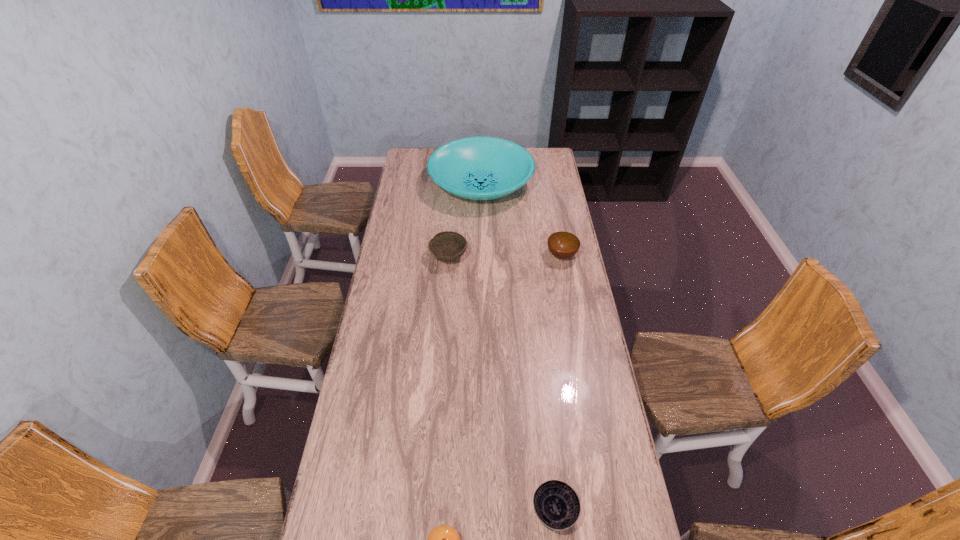
The height and width of the screenshot is (540, 960). I want to click on the tallest object, so click(478, 168).

Find the location of a particular element. the farthest object is located at coordinates (478, 168).

Where is `the leftmost bowl`? the leftmost bowl is located at coordinates (447, 246).

The image size is (960, 540). I want to click on the rightmost object, so click(x=563, y=245).

You are a GUI agent. You are given a task and a screenshot of the screen. Output one action in this format:
    pyautogui.click(x=<x>, y=<y>)
    Task: Click on the shortest object
    Image resolution: width=960 pixels, height=540 pixels.
    Given the screenshot: What is the action you would take?
    pyautogui.click(x=556, y=504)

The image size is (960, 540). I want to click on the shortest bowl, so click(x=556, y=504).

Where is `vacant space located on the front of the dish`? The width and height of the screenshot is (960, 540). vacant space located on the front of the dish is located at coordinates (481, 247).

Identify the location of vacant space located on the left of the leftmost bowl. This screenshot has width=960, height=540. (409, 257).

Locate an element on the screen. vacant area located on the back of the rightmost object is located at coordinates (558, 233).

Locate an element on the screen. free spot located on the left of the shortest bowl is located at coordinates (404, 511).